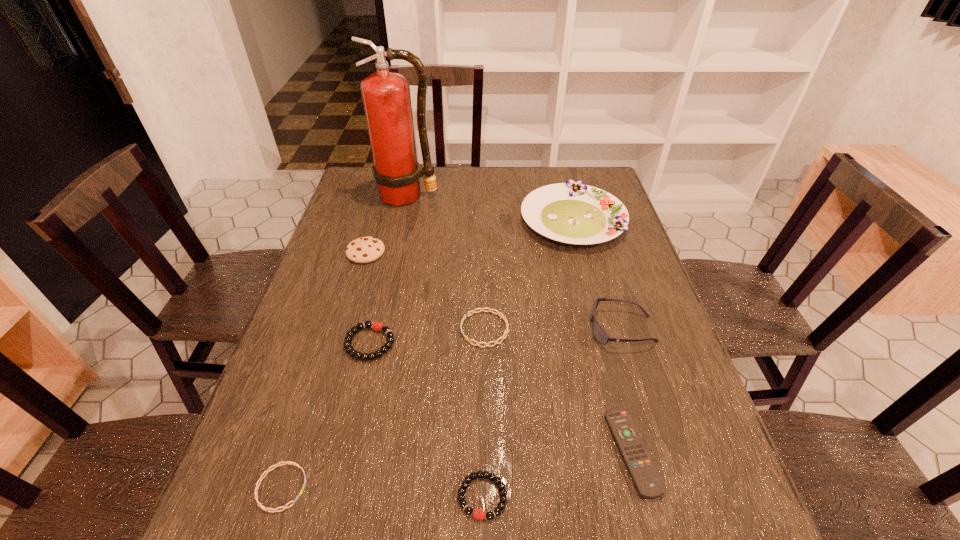
Where is `object at the near edge`? This screenshot has width=960, height=540. object at the near edge is located at coordinates (478, 514).

Identify the location of fire extinguisher at the left edge. (386, 96).

I want to click on cookie that is positioned at the left edge, so click(x=365, y=249).

What are the coordinates of `salad plate that is positioned at the right edge` in the screenshot? It's located at (572, 212).

Locate an element on the screen. This screenshot has height=540, width=960. sunglasses at the right edge is located at coordinates (600, 335).

Identify the location of remote control located in the right edge section of the desktop. (641, 467).

In order to click on object present at the far left corner in this screenshot , I will do `click(386, 96)`.

I want to click on object present at the far right corner, so [x=572, y=212].

Where is `free region at the far edge of the desktop`? free region at the far edge of the desktop is located at coordinates (515, 171).

This screenshot has height=540, width=960. What are the coordinates of `vacant position at the left edge of the desktop` in the screenshot? It's located at (286, 461).